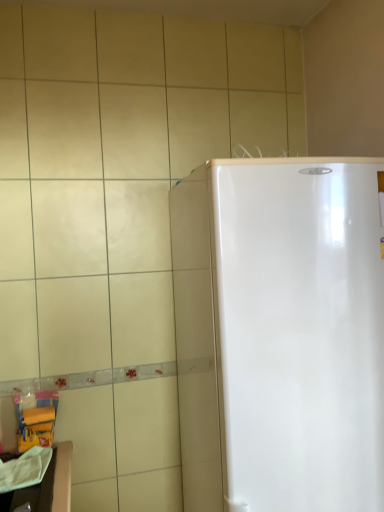
Question: Is white glossy refrigerator at right surrounded by white glossy counter top at lower left?

Choices:
 (A) no
 (B) yes

Answer: (A)

Question: Does white glossy counter top at lower left appear on the left side of white glossy refrigerator at right?

Choices:
 (A) no
 (B) yes

Answer: (B)

Question: Is white glossy counter top at lower left not near white glossy refrigerator at right?

Choices:
 (A) no
 (B) yes

Answer: (A)

Question: From the image's perspective, would you say white glossy counter top at lower left is shown under white glossy refrigerator at right?

Choices:
 (A) no
 (B) yes

Answer: (B)

Question: From the image's perspective, is white glossy counter top at lower left over white glossy refrigerator at right?

Choices:
 (A) yes
 (B) no

Answer: (B)

Question: Is white glossy counter top at lower left bigger than white glossy refrigerator at right?

Choices:
 (A) yes
 (B) no

Answer: (B)

Question: Could you tell me if white glossy refrigerator at right is turned towards white glossy counter top at lower left?

Choices:
 (A) yes
 (B) no

Answer: (B)

Question: From the image's perspective, would you say white glossy refrigerator at right is positioned over white glossy counter top at lower left?

Choices:
 (A) yes
 (B) no

Answer: (A)

Question: Considering the relative sizes of white glossy refrigerator at right and white glossy counter top at lower left in the image provided, is white glossy refrigerator at right smaller than white glossy counter top at lower left?

Choices:
 (A) no
 (B) yes

Answer: (A)

Question: Is white glossy refrigerator at right next to white glossy counter top at lower left?

Choices:
 (A) yes
 (B) no

Answer: (B)

Question: Does white glossy refrigerator at right come behind white glossy counter top at lower left?

Choices:
 (A) yes
 (B) no

Answer: (B)

Question: From a real-world perspective, is white glossy refrigerator at right located beneath white glossy counter top at lower left?

Choices:
 (A) yes
 (B) no

Answer: (B)

Question: From the image's perspective, is white glossy refrigerator at right above or below white glossy counter top at lower left?

Choices:
 (A) above
 (B) below

Answer: (A)